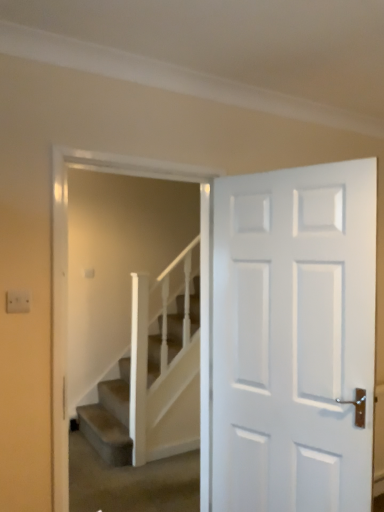
Question: From the image's perspective, is white textured stairs at center above or below white matte door at right?

Choices:
 (A) below
 (B) above

Answer: (A)

Question: In terms of size, does white textured stairs at center appear bigger or smaller than white matte door at right?

Choices:
 (A) small
 (B) big

Answer: (A)

Question: Is white textured stairs at center in front of or behind white matte door at right in the image?

Choices:
 (A) front
 (B) behind

Answer: (B)

Question: Visually, is white matte door at right positioned to the left or to the right of white textured stairs at center?

Choices:
 (A) right
 (B) left

Answer: (A)

Question: From the image's perspective, is white matte door at right above or below white textured stairs at center?

Choices:
 (A) below
 (B) above

Answer: (B)

Question: Considering the positions of point (286, 220) and point (125, 391), is point (286, 220) closer or farther from the camera than point (125, 391)?

Choices:
 (A) closer
 (B) farther

Answer: (A)

Question: In the image, is white matte door at right positioned in front of or behind white textured stairs at center?

Choices:
 (A) front
 (B) behind

Answer: (A)